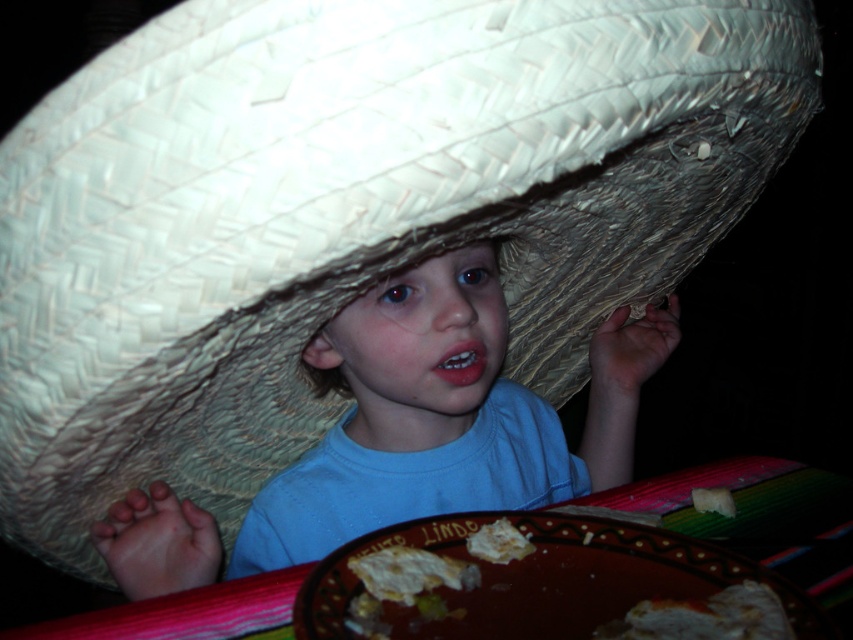
Does white crumbly bread at lower right have a smaller size compared to white crumbly cheese at lower center?

No.

Is white crumbly bread at lower right above white crumbly cheese at lower center?

No, white crumbly bread at lower right is not above white crumbly cheese at lower center.

Where is `white crumbly bread at lower right`? This screenshot has width=853, height=640. white crumbly bread at lower right is located at coordinates pos(705,618).

Locate an element on the screen. This screenshot has height=640, width=853. brown ceramic platter at lower center is located at coordinates (538, 582).

Is point (607, 536) farther from viewer compared to point (496, 525)?

Yes.

Who is positioned more to the right, brown ceramic platter at lower center or white crumbly bread at lower center?

From the viewer's perspective, brown ceramic platter at lower center appears more on the right side.

Identify the location of brown ceramic platter at lower center. This screenshot has width=853, height=640. (538, 582).

This screenshot has height=640, width=853. What are the coordinates of `brown ceramic platter at lower center` in the screenshot? It's located at (538, 582).